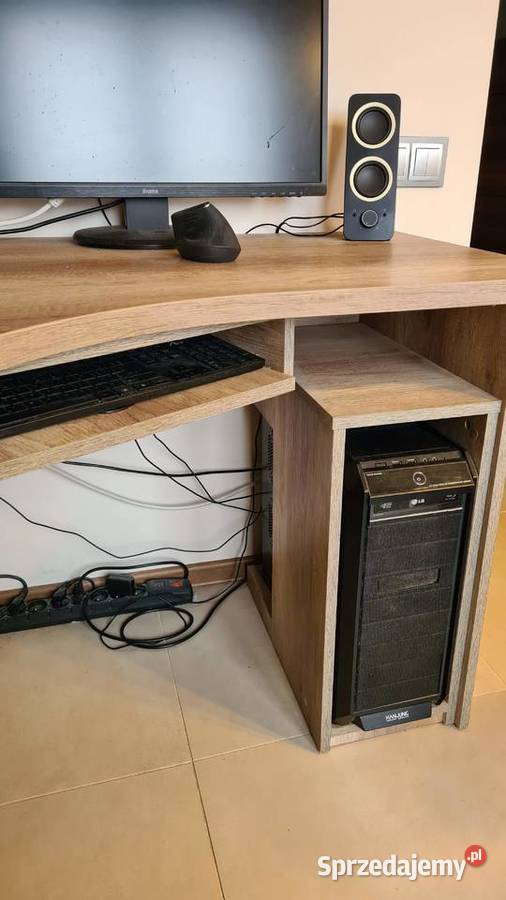
Where is `keyboard`? The height and width of the screenshot is (900, 506). keyboard is located at coordinates (134, 378).